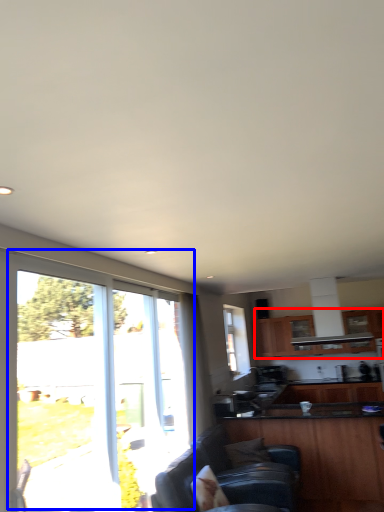
Question: Among these objects, which one is nearest to the camera, cabinetry (highlighted by a red box) or window (highlighted by a blue box)?

Choices:
 (A) cabinetry
 (B) window

Answer: (B)